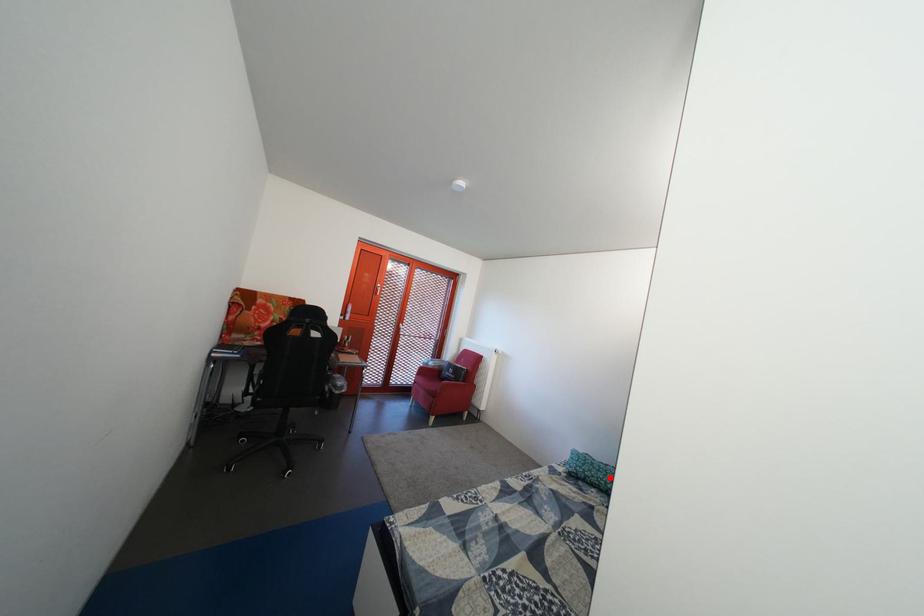
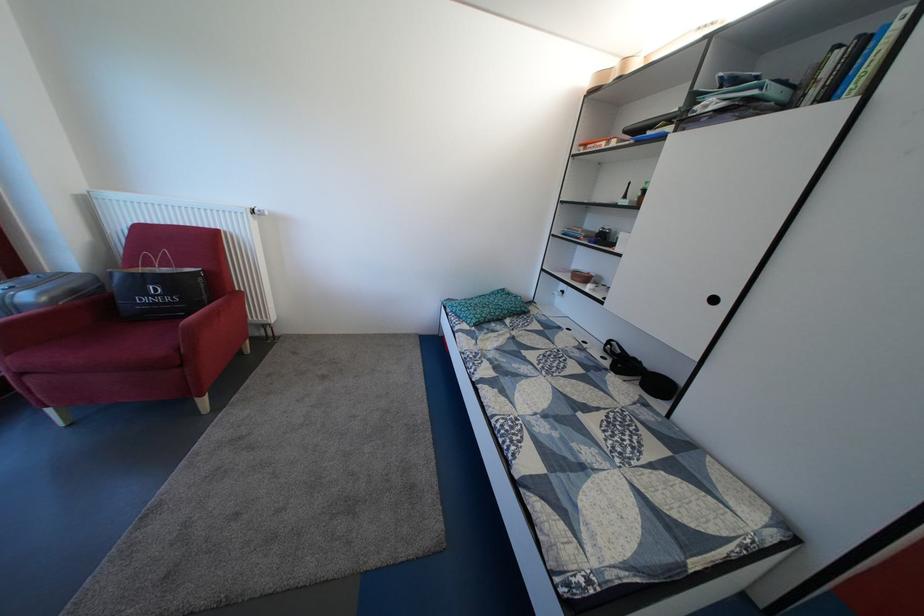
Locate, in the second image, the point that corresponds to the highlighted location in the first image.

(494, 314)